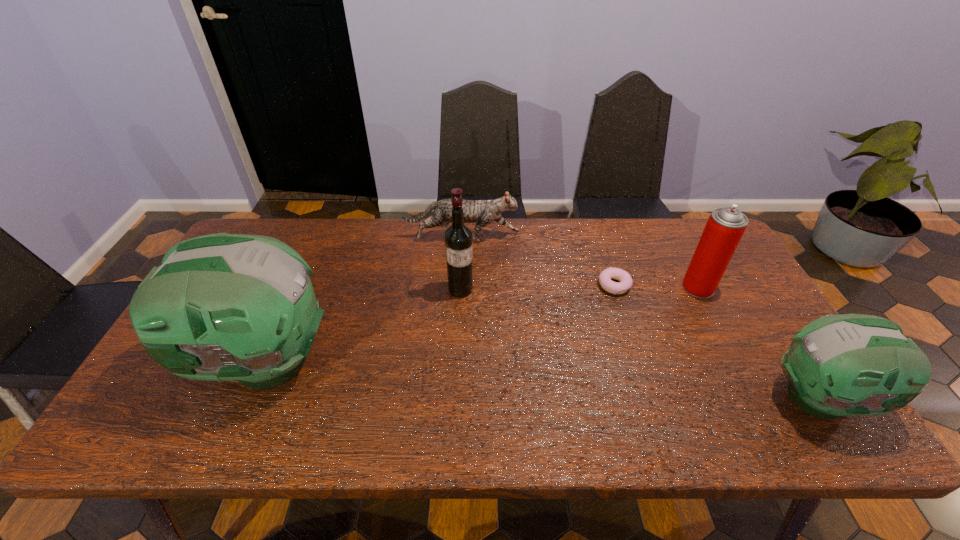
Identify the location of the left football helmet. (220, 307).

Identify the location of the taller football helmet. The image size is (960, 540). (220, 307).

What are the coordinates of `the third shortest object` in the screenshot? It's located at (839, 365).

At what (x,y) coordinates should I click in order to perform the action: click on the shorter football helmet. Please return your answer as a coordinate pair (x, y). This screenshot has height=540, width=960. Looking at the image, I should click on (839, 365).

Find the location of a particular element. Image resolution: width=960 pixels, height=540 pixels. cat is located at coordinates (483, 212).

Identify the location of the farthest object. Image resolution: width=960 pixels, height=540 pixels. (483, 212).

I want to click on wine bottle, so click(458, 238).

At what (x,y) coordinates should I click in order to perform the action: click on the third tallest object. Please return your answer as a coordinate pair (x, y). Looking at the image, I should click on (725, 227).

Identify the location of the shortest object. (624, 285).

I want to click on doughnut, so tap(624, 285).